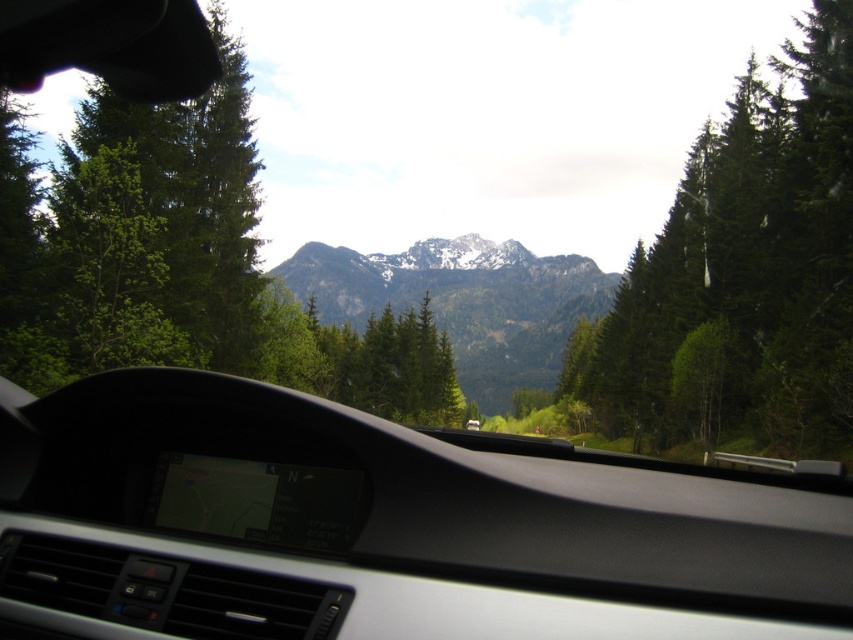
Question: Is green textured tree at right smaller than snowy rocky mountain at center?

Choices:
 (A) yes
 (B) no

Answer: (A)

Question: Which is nearer to the green matte tree at left?

Choices:
 (A) transparent glass windshield at center
 (B) green textured tree at right
 (C) snowy rocky mountain at center

Answer: (A)

Question: Which of the following is the farthest from the observer?

Choices:
 (A) pyautogui.click(x=712, y=358)
 (B) pyautogui.click(x=93, y=328)
 (C) pyautogui.click(x=642, y=548)

Answer: (A)

Question: Does green textured tree at right have a lesser width compared to green matte tree at left?

Choices:
 (A) no
 (B) yes

Answer: (B)

Question: Which of the following is the closest to the observer?

Choices:
 (A) (97, 246)
 (B) (660, 628)

Answer: (B)

Question: Is transparent glass windshield at center positioned before green textured tree at right?

Choices:
 (A) no
 (B) yes

Answer: (B)